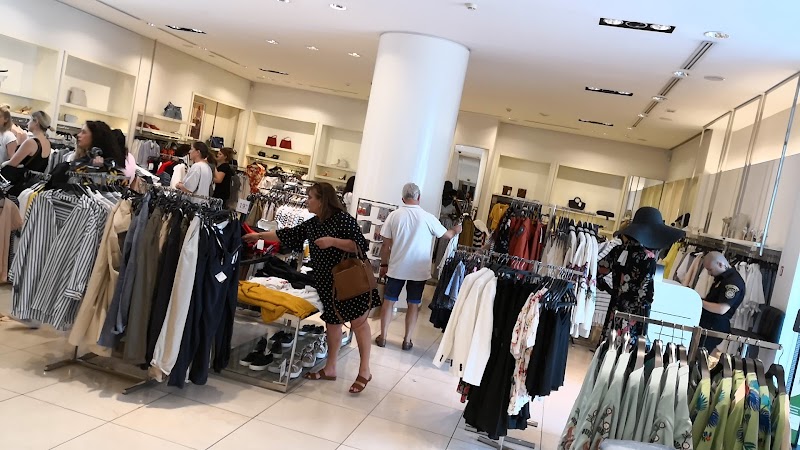
Find the location of a particular element. This screenshot has height=450, width=800. load-bearing column is located at coordinates (418, 136).